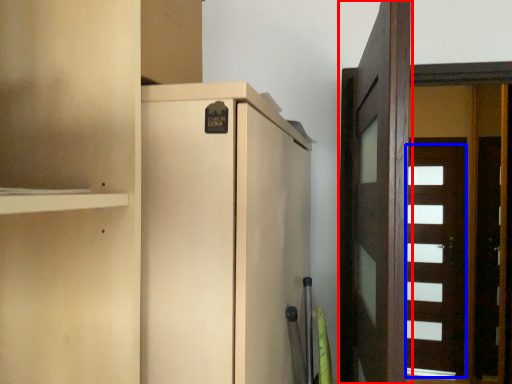
Question: Which of the following is the farthest to the observer, door (highlighted by a red box) or door (highlighted by a blue box)?

Choices:
 (A) door
 (B) door

Answer: (B)